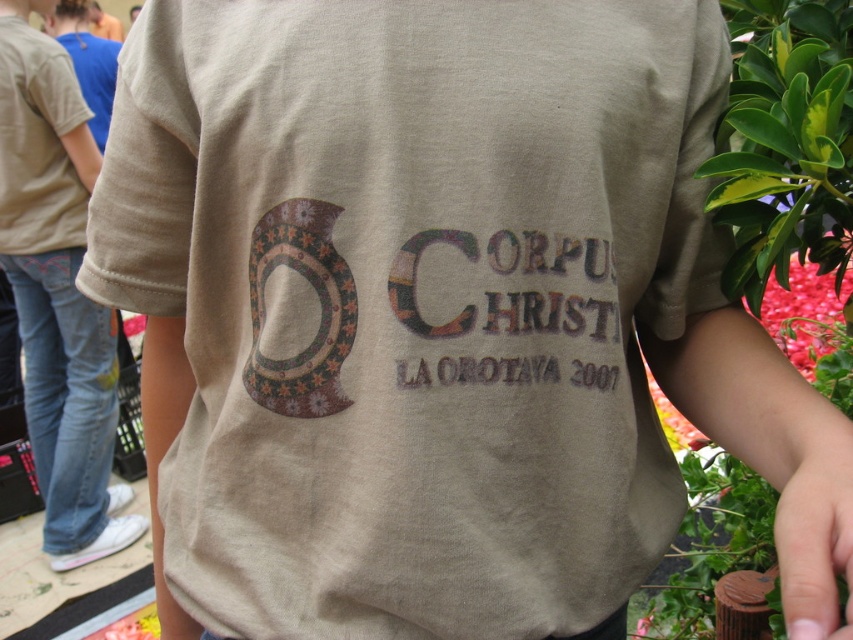
Can you confirm if light brown cotton shirt at center is positioned to the right of distressed brown text at center?

In fact, light brown cotton shirt at center is to the left of distressed brown text at center.

Who is higher up, light brown cotton shirt at center or distressed brown text at center?

Positioned higher is light brown cotton shirt at center.

Is point (71, 332) positioned in front of point (610, 326)?

No.

Identify the location of light brown cotton shirt at center. Image resolution: width=853 pixels, height=640 pixels. click(57, 292).